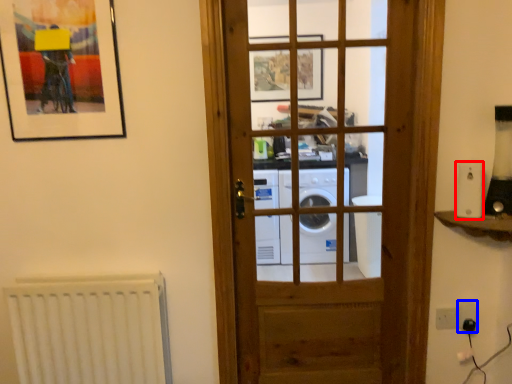
Question: Which object is further to the camera taking this photo, appliance (highlighted by a red box) or electric outlet (highlighted by a blue box)?

Choices:
 (A) appliance
 (B) electric outlet

Answer: (B)